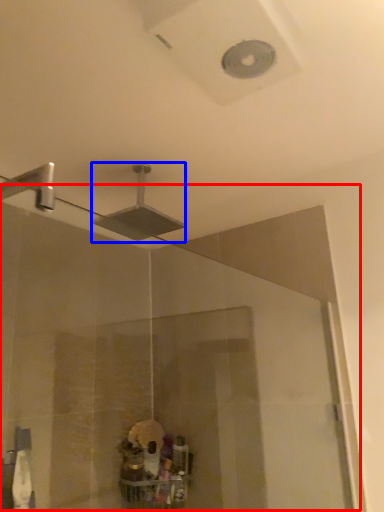
Question: Among these objects, which one is nearest to the camera, glass door (highlighted by a red box) or shower (highlighted by a blue box)?

Choices:
 (A) glass door
 (B) shower

Answer: (A)